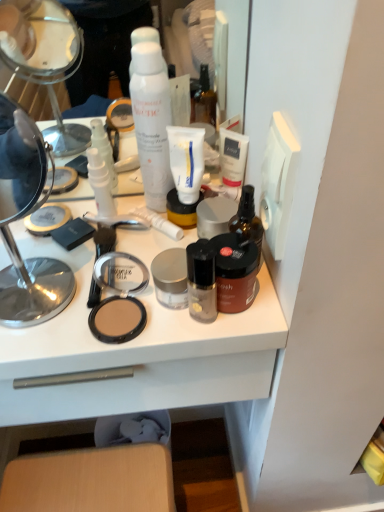
Question: Is satin black foundation at center, the fourth toiletry from the left, facing towards satin silver jar at center, the 3th toiletry viewed from the right?

Choices:
 (A) yes
 (B) no

Answer: (B)

Question: From a real-world perspective, is satin black foundation at center, the fourth toiletry from the left, under satin silver jar at center, which is counted as the third toiletry, starting from the left?

Choices:
 (A) yes
 (B) no

Answer: (B)

Question: From the image's perspective, is satin black foundation at center, placed as the 2th toiletry when sorted from right to left, above satin silver jar at center, which is counted as the third toiletry, starting from the left?

Choices:
 (A) yes
 (B) no

Answer: (B)

Question: Is satin black foundation at center, the fourth toiletry from the left, at the left side of satin silver jar at center, the 3th toiletry viewed from the right?

Choices:
 (A) yes
 (B) no

Answer: (B)

Question: Does satin black foundation at center, placed as the 2th toiletry when sorted from right to left, have a greater width compared to satin silver jar at center, the 3th toiletry viewed from the right?

Choices:
 (A) yes
 (B) no

Answer: (B)

Question: Is satin black foundation at center, placed as the 2th toiletry when sorted from right to left, oriented away from satin silver jar at center, the 3th toiletry viewed from the right?

Choices:
 (A) no
 (B) yes

Answer: (B)

Question: From a real-world perspective, is white matte tube at center positioned under white plastic tube at center, the fourth toiletry positioned from the right, based on gravity?

Choices:
 (A) yes
 (B) no

Answer: (B)

Question: Is there a large distance between white matte tube at center and white plastic tube at center, the fourth toiletry positioned from the right?

Choices:
 (A) yes
 (B) no

Answer: (B)

Question: Is white matte tube at center shorter than white plastic tube at center, which appears as the second toiletry when viewed from the left?

Choices:
 (A) yes
 (B) no

Answer: (B)

Question: Is white matte tube at center outside white plastic tube at center, which appears as the second toiletry when viewed from the left?

Choices:
 (A) no
 (B) yes

Answer: (B)

Question: Does white matte tube at center have a larger size compared to white plastic tube at center, which appears as the second toiletry when viewed from the left?

Choices:
 (A) yes
 (B) no

Answer: (A)

Question: From the image's perspective, is white matte tube at center beneath white plastic tube at center, the fourth toiletry positioned from the right?

Choices:
 (A) yes
 (B) no

Answer: (B)

Question: From a real-world perspective, is transparent plastic bottles at center, positioned as the first toiletry in left-to-right order, below white matte shaving cream at center?

Choices:
 (A) yes
 (B) no

Answer: (A)